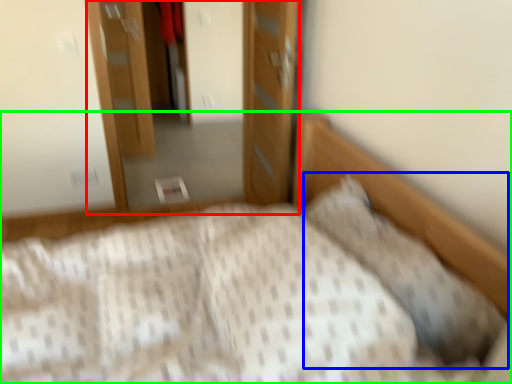
Question: Which object is the farthest from dresser (highlighted by a red box)? Choose among these: pillow (highlighted by a blue box) or bed (highlighted by a green box).

Choices:
 (A) pillow
 (B) bed

Answer: (A)